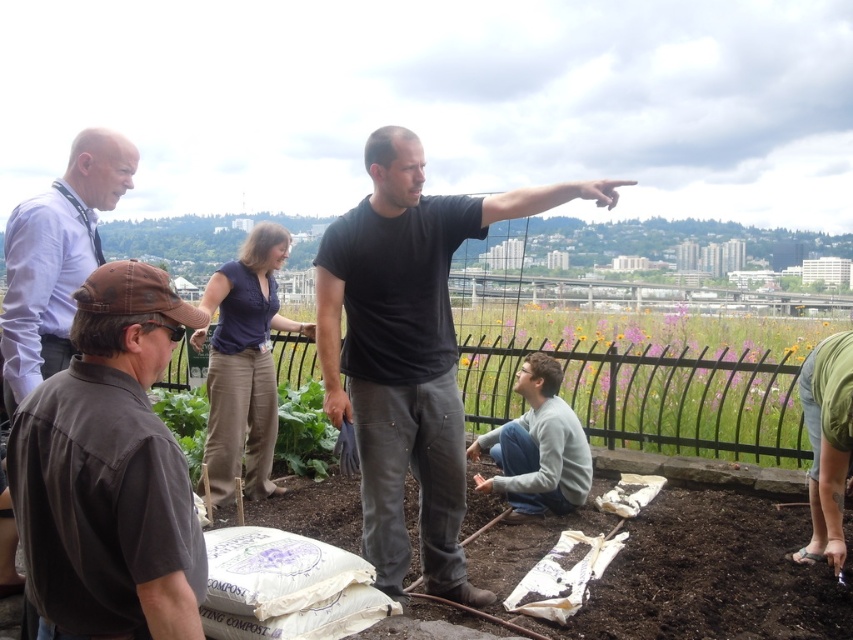
Between black matte shirt at center and gray fleece sweater at center, which one has more height?

With more height is black matte shirt at center.

Is black matte shirt at center wider than gray fleece sweater at center?

Yes.

The width and height of the screenshot is (853, 640). What are the coordinates of `black matte shirt at center` in the screenshot? It's located at (408, 349).

Between point (71, 488) and point (399, 253), which one is positioned in front?

Point (71, 488) is more forward.

In the scene shown: Between brown fabric cap at lower left and black matte shirt at center, which one is positioned lower?

brown fabric cap at lower left is below.

In order to click on brown fabric cap at lower left in this screenshot , I will do `click(109, 472)`.

Where is `brown fabric cap at lower left`? Image resolution: width=853 pixels, height=640 pixels. brown fabric cap at lower left is located at coordinates (109, 472).

Does black matte shirt at center appear on the left side of light blue shirt at upper left?

In fact, black matte shirt at center is to the right of light blue shirt at upper left.

Does black matte shirt at center have a smaller size compared to light blue shirt at upper left?

No.

The height and width of the screenshot is (640, 853). What do you see at coordinates (408, 349) in the screenshot?
I see `black matte shirt at center` at bounding box center [408, 349].

You are a GUI agent. You are given a task and a screenshot of the screen. Output one action in this format:
    pyautogui.click(x=<x>, y=<y>)
    Task: Click on the black matte shirt at center
    
    Given the screenshot: What is the action you would take?
    pyautogui.click(x=408, y=349)